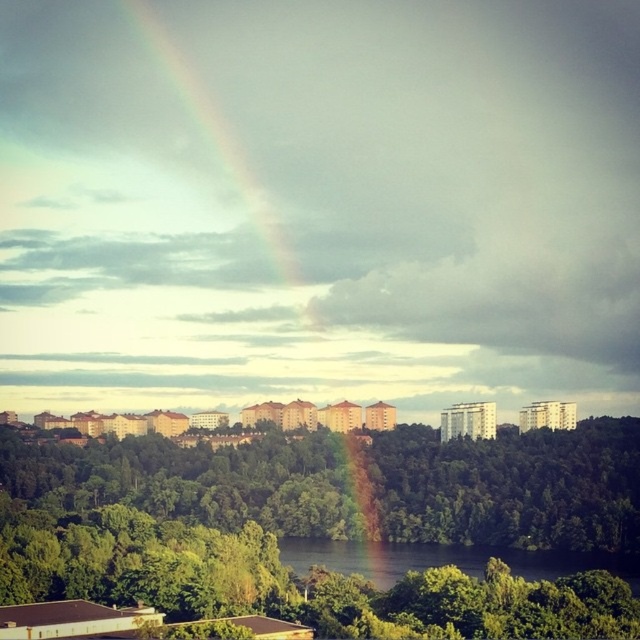
Between green leafy tree at center and rainbow at upper center, which one has more height?

rainbow at upper center

Can you confirm if green leafy tree at center is positioned below rainbow at upper center?

Correct, green leafy tree at center is located below rainbow at upper center.

Does point (129, 531) come behind point (177, 64)?

No, it is in front of (177, 64).

Find the location of a particular element. This screenshot has height=640, width=640. green leafy tree at center is located at coordinates (330, 528).